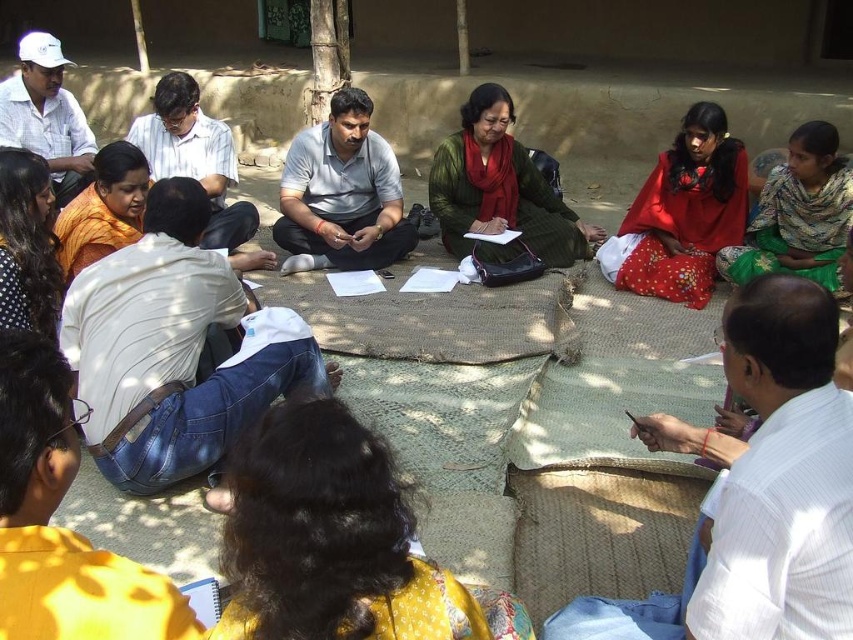
What do you see at coordinates (341, 193) in the screenshot? This screenshot has width=853, height=640. I see `light gray cotton shirt at center` at bounding box center [341, 193].

Is light gray cotton shirt at center above green woolen sweater at center?

Correct, light gray cotton shirt at center is located above green woolen sweater at center.

This screenshot has width=853, height=640. I want to click on light gray cotton shirt at center, so click(x=341, y=193).

Between dark brown hair at lower center and red fabric sari at right, which one appears on the left side from the viewer's perspective?

dark brown hair at lower center is more to the left.

Which of these two, dark brown hair at lower center or red fabric sari at right, stands taller?

Standing taller between the two is red fabric sari at right.

Does point (399, 499) come behind point (692, 120)?

No, it is in front of (692, 120).

In order to click on dark brown hair at lower center in this screenshot , I will do `click(335, 541)`.

Between dark brown hair at lower center and printed cotton sari at upper right, which one is positioned higher?

printed cotton sari at upper right is higher up.

Can you confirm if dark brown hair at lower center is shorter than printed cotton sari at upper right?

Yes.

Measure the distance between dark brown hair at lower center and camera.

dark brown hair at lower center is 39.14 inches away from camera.

Locate an element on the screen. dark brown hair at lower center is located at coordinates (335, 541).